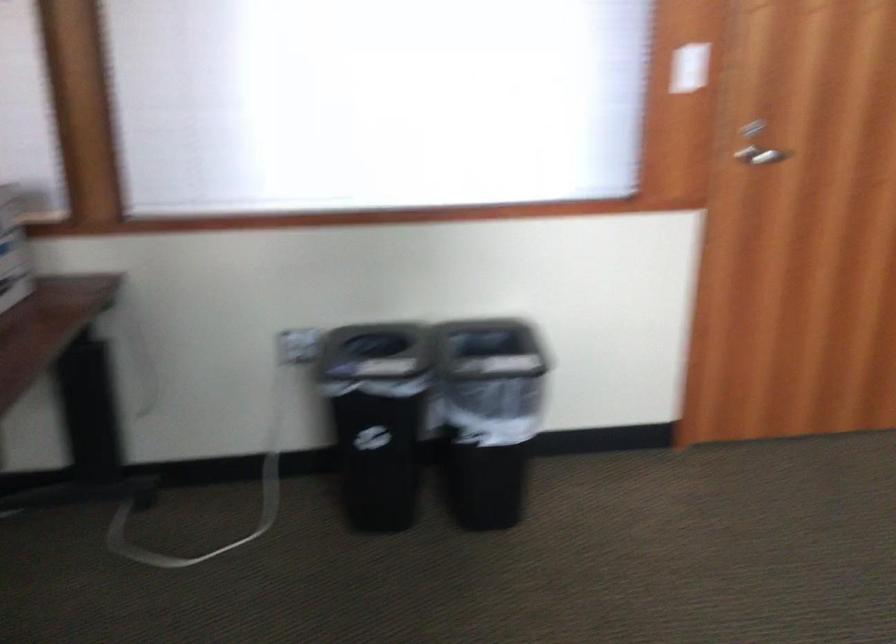
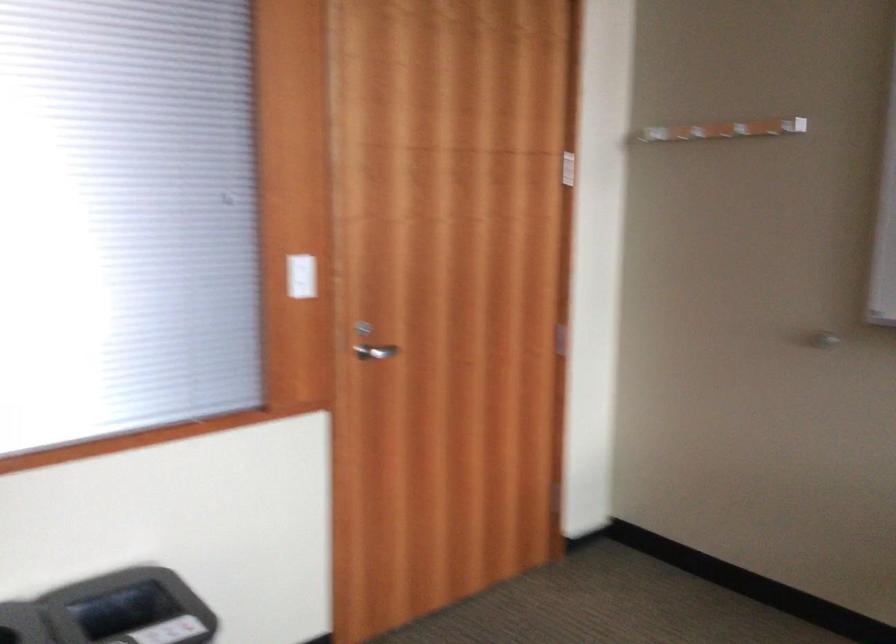
In the second image, find the point that corresponds to (x=757, y=152) in the first image.

(375, 351)